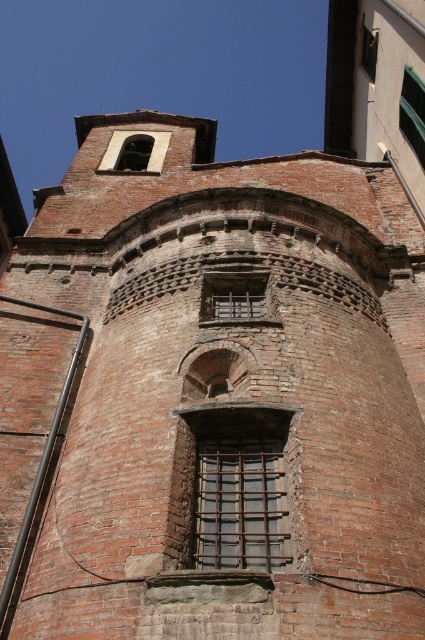
From the picture: Between green glass window at upper right and matte brick window at upper center, which one is positioned higher?

matte brick window at upper center

Can you confirm if green glass window at upper right is bigger than matte brick window at upper center?

Correct, green glass window at upper right is larger in size than matte brick window at upper center.

Describe the element at coordinates (413, 113) in the screenshot. I see `green glass window at upper right` at that location.

The width and height of the screenshot is (425, 640). What are the coordinates of `green glass window at upper right` in the screenshot? It's located at (413, 113).

Is rusty metal bars at center thinner than green glass window at upper right?

Yes, rusty metal bars at center is thinner than green glass window at upper right.

Is point (235, 278) closer to viewer compared to point (424, 102)?

Yes, point (235, 278) is closer to viewer.

At what (x,y) coordinates should I click in order to perform the action: click on rusty metal bars at center. Please return your answer as a coordinate pair (x, y). This screenshot has height=640, width=425. Looking at the image, I should click on (232, 296).

Who is more distant from viewer, (x=232, y=284) or (x=368, y=61)?

The point (x=368, y=61) is more distant.

Measure the distance between point (x=235, y=301) and camera.

Point (x=235, y=301) is 43.30 meters away from camera.

Identify the location of rusty metal bars at center. Image resolution: width=425 pixels, height=640 pixels. (232, 296).